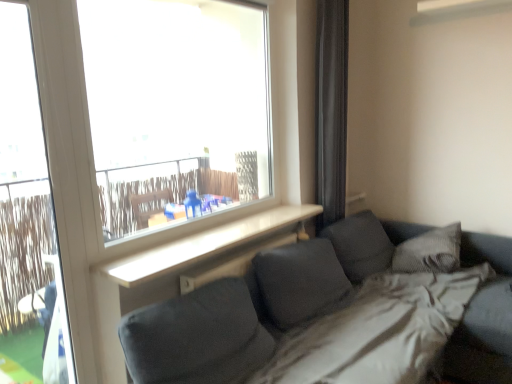
Image resolution: width=512 pixels, height=384 pixels. What do you see at coordinates (430, 251) in the screenshot? I see `textured gray pillow at right` at bounding box center [430, 251].

The image size is (512, 384). What do you see at coordinates (331, 109) in the screenshot? I see `black fabric curtain at right` at bounding box center [331, 109].

What are the coordinates of `textured gray pillow at right` in the screenshot? It's located at (430, 251).

Which of these two, black fabric curtain at right or white plastic screen door at left, is bigger?

white plastic screen door at left is bigger.

Is black fabric curtain at right far away from white plastic screen door at left?

Absolutely, black fabric curtain at right is distant from white plastic screen door at left.

From a real-world perspective, is black fabric curtain at right over white plastic screen door at left?

Yes, from a real-world perspective, black fabric curtain at right is over white plastic screen door at left

Would you say black fabric curtain at right is to the left or to the right of white plastic screen door at left in the picture?

Clearly, black fabric curtain at right is on the right of white plastic screen door at left in the image.

Could you tell me if black fabric curtain at right is facing textured gray pillow at right?

Yes, black fabric curtain at right is facing textured gray pillow at right.

Find the location of a particular element. This screenshot has height=384, width=512. pillow that is on the right side of black fabric curtain at right is located at coordinates (430, 251).

Based on the photo, is black fabric curtain at right wider or thinner than textured gray pillow at right?

Considering their sizes, black fabric curtain at right looks slimmer than textured gray pillow at right.

Is textured gray pillow at right surrounded by white plastic screen door at left?

No, white plastic screen door at left does not contain textured gray pillow at right.

Are white plastic screen door at left and textured gray pillow at right beside each other?

No, white plastic screen door at left is not making contact with textured gray pillow at right.

Between white plastic screen door at left and textured gray pillow at right, which one has less height?

Standing shorter between the two is textured gray pillow at right.

Where is `pillow behind the white plastic screen door at left`? pillow behind the white plastic screen door at left is located at coordinates click(x=430, y=251).

Considering the relative sizes of textured gray pillow at right and black fabric curtain at right in the image provided, is textured gray pillow at right smaller than black fabric curtain at right?

Yes.

Where is `pillow located on the right of black fabric curtain at right`? pillow located on the right of black fabric curtain at right is located at coordinates (430, 251).

Is textured gray pillow at right in contact with black fabric curtain at right?

textured gray pillow at right is not next to black fabric curtain at right, and they're not touching.

Does textured gray pillow at right have a greater width compared to white plastic screen door at left?

Indeed, textured gray pillow at right has a greater width compared to white plastic screen door at left.

Are textured gray pillow at right and white plastic screen door at left making contact?

No, textured gray pillow at right is not beside white plastic screen door at left.

Could you tell me if textured gray pillow at right is turned towards white plastic screen door at left?

Yes.

Who is bigger, textured gray pillow at right or white plastic screen door at left?

white plastic screen door at left is bigger.

From the image's perspective, is white plastic screen door at left beneath black fabric curtain at right?

Yes, from the image's perspective, white plastic screen door at left is below black fabric curtain at right.

Can you confirm if white plastic screen door at left is shorter than black fabric curtain at right?

In fact, white plastic screen door at left may be taller than black fabric curtain at right.

Considering the sizes of objects white plastic screen door at left and black fabric curtain at right in the image provided, who is bigger, white plastic screen door at left or black fabric curtain at right?

Bigger between the two is white plastic screen door at left.

Considering their positions, is white plastic screen door at left located in front of or behind black fabric curtain at right?

white plastic screen door at left is positioned closer to the viewer than black fabric curtain at right.

Where is `screen door below the black fabric curtain at right (from a real-world perspective)`? The width and height of the screenshot is (512, 384). screen door below the black fabric curtain at right (from a real-world perspective) is located at coordinates (27, 215).

At what (x,y) coordinates should I click in order to perform the action: click on curtain above the textured gray pillow at right (from a real-world perspective). Please return your answer as a coordinate pair (x, y). The image size is (512, 384). Looking at the image, I should click on (331, 109).

From the image, which object appears to be nearer to white plastic screen door at left, textured gray pillow at right or black fabric curtain at right?

black fabric curtain at right is closer to white plastic screen door at left.

From the image, which object appears to be nearer to black fabric curtain at right, white plastic screen door at left or textured gray pillow at right?

Among the two, textured gray pillow at right is located nearer to black fabric curtain at right.

Looking at the image, which one is located closer to textured gray pillow at right, black fabric curtain at right or white plastic screen door at left?

Among the two, black fabric curtain at right is located nearer to textured gray pillow at right.

From the image, which object appears to be nearer to white plastic screen door at left, black fabric curtain at right or textured gray pillow at right?

The object closer to white plastic screen door at left is black fabric curtain at right.

Estimate the real-world distances between objects in this image. Which object is further from black fabric curtain at right, textured gray pillow at right or white plastic screen door at left?

white plastic screen door at left lies further to black fabric curtain at right than the other object.

Estimate the real-world distances between objects in this image. Which object is further from textured gray pillow at right, white plastic screen door at left or black fabric curtain at right?

Among the two, white plastic screen door at left is located further to textured gray pillow at right.

Where is `curtain located between white plastic screen door at left and textured gray pillow at right in the left-right direction`? The width and height of the screenshot is (512, 384). curtain located between white plastic screen door at left and textured gray pillow at right in the left-right direction is located at coordinates (331, 109).